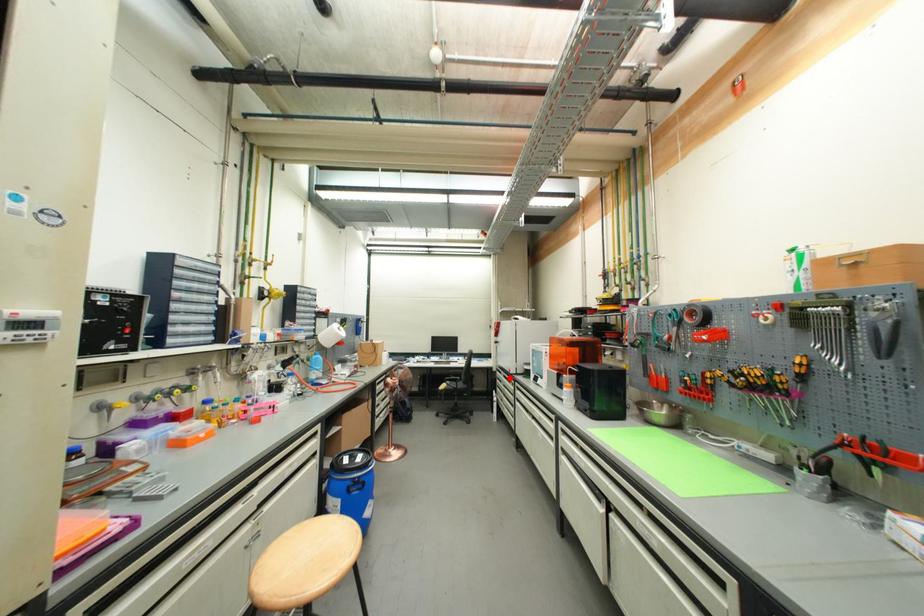
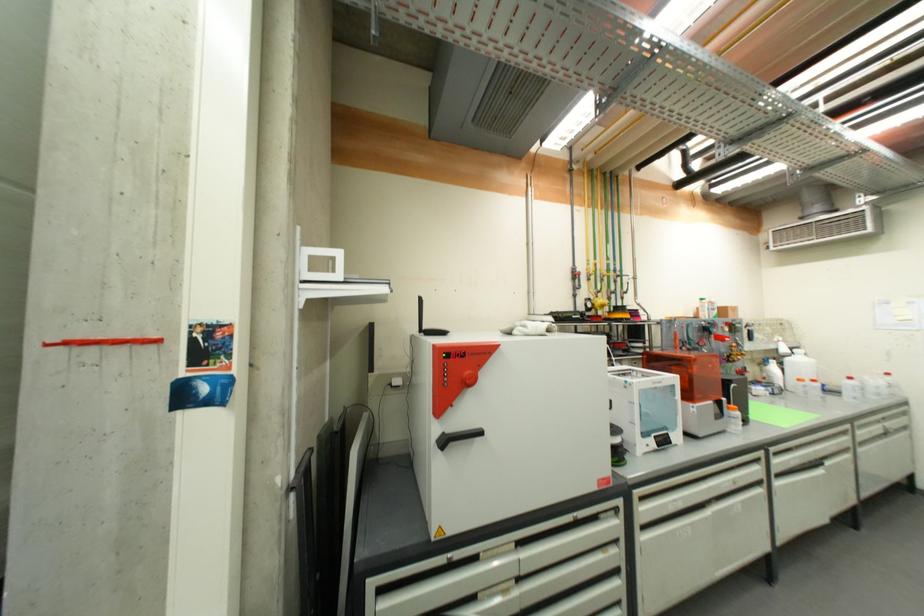
Locate, in the second image, the point that corresponds to the highlighted location in the first image.

(525, 546)